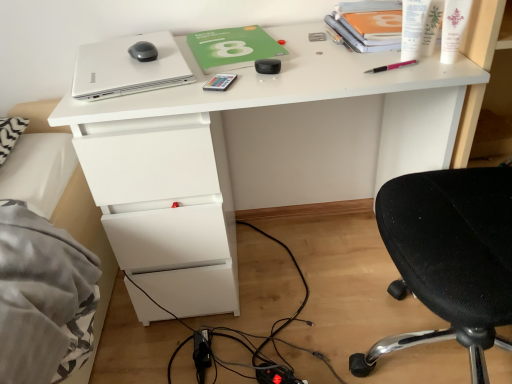
Where is `free area behind metallic rectangular object at center, the 1th stationery in the left-to-right sequence`? The width and height of the screenshot is (512, 384). free area behind metallic rectangular object at center, the 1th stationery in the left-to-right sequence is located at coordinates (245, 62).